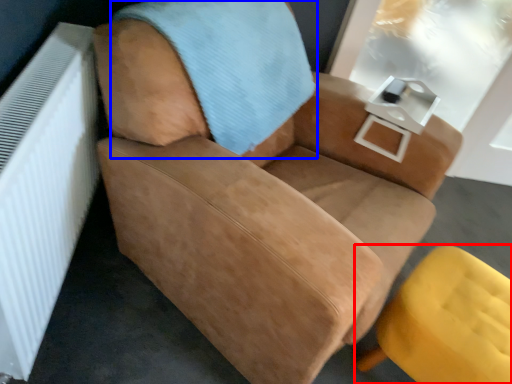
Question: Which of the following is the farthest to the observer, chair (highlighted by a red box) or blanket (highlighted by a blue box)?

Choices:
 (A) chair
 (B) blanket

Answer: (A)